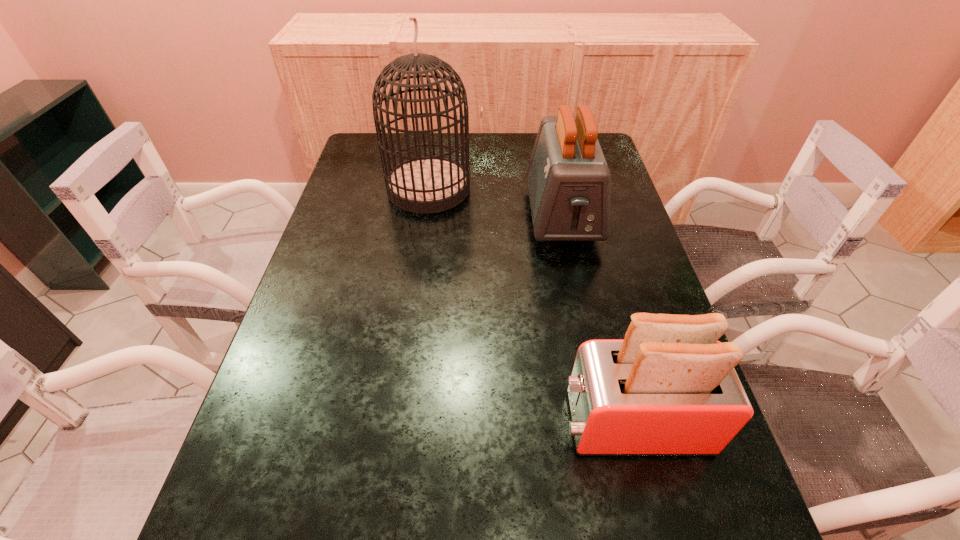
Where is `empty space between the nearest object and the farther toaster`? empty space between the nearest object and the farther toaster is located at coordinates (597, 319).

The width and height of the screenshot is (960, 540). Find the location of `vacant area that lies between the birdcage and the farther toaster`. vacant area that lies between the birdcage and the farther toaster is located at coordinates (495, 202).

At what (x,y) coordinates should I click in order to perform the action: click on empty space that is in between the leftmost object and the farther toaster. Please return your answer as a coordinate pair (x, y). Image resolution: width=960 pixels, height=540 pixels. Looking at the image, I should click on (495, 202).

Where is `free space between the nearer toaster and the birdcage`? This screenshot has height=540, width=960. free space between the nearer toaster and the birdcage is located at coordinates (531, 305).

Identify the location of free spot between the nearest object and the leftmost object. This screenshot has height=540, width=960. (531, 305).

Locate an element on the screen. This screenshot has height=540, width=960. object that ranks as the second closest to the nearer toaster is located at coordinates (430, 184).

You are a GUI agent. You are given a task and a screenshot of the screen. Output one action in this format:
    pyautogui.click(x=<x>, y=<y>)
    Task: Click on the object that is the closest to the nearer toaster
    
    Given the screenshot: What is the action you would take?
    pyautogui.click(x=569, y=183)